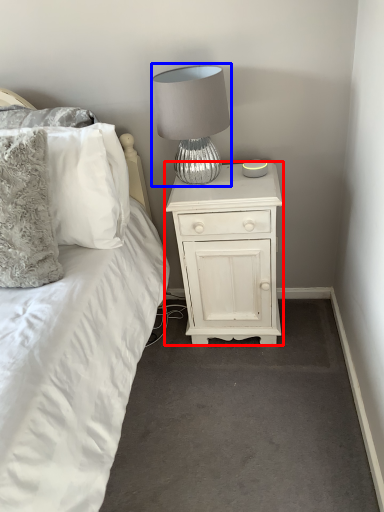
Question: Among these objects, which one is nearest to the camera, nightstand (highlighted by a red box) or lamp (highlighted by a blue box)?

Choices:
 (A) nightstand
 (B) lamp

Answer: (B)